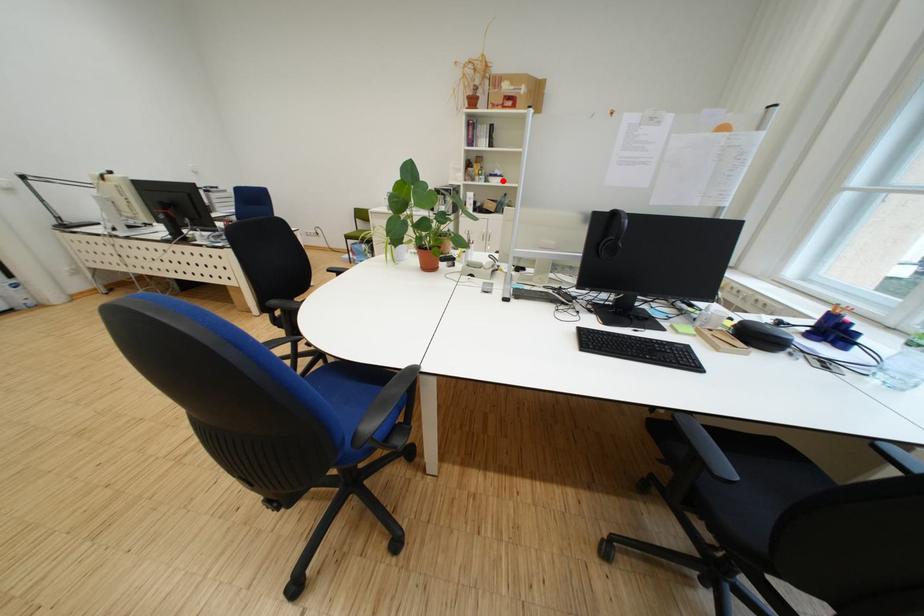
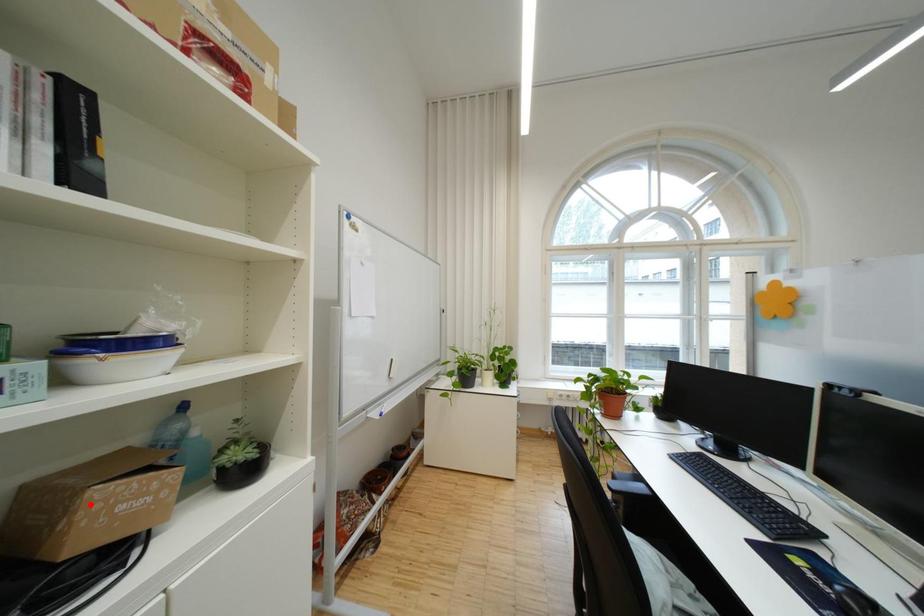
I am providing you with two images of the same scene from different viewpoints. A red point is marked on the first image and another point is marked on the second image. Is the red point in image1 aligned with the point shown in image2?

No